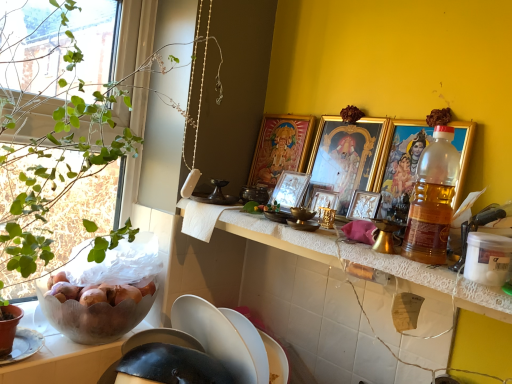
Question: Considering the positions of point (39, 23) and point (406, 178), is point (39, 23) closer or farther from the camera than point (406, 178)?

Choices:
 (A) farther
 (B) closer

Answer: (B)

Question: Would you say green leafy plant at left is to the left or to the right of gold-framed picture at right, arranged as the 5th picture frame when viewed from the back, in the picture?

Choices:
 (A) right
 (B) left

Answer: (B)

Question: Which object is the closest to the translucent plastic bottle at right?

Choices:
 (A) white lace countertop at center
 (B) green leafy plant at left
 (C) gold metallic picture frame at upper center, the fourth picture frame positioned from the back
 (D) metallic silver picture frame at center, positioned as the third picture frame in front-to-back order
 (E) gold-framed picture at center, arranged as the fourth picture frame when viewed from the front

Answer: (A)

Question: Which object is the farthest from the gold-framed picture at center, arranged as the fourth picture frame when viewed from the front?

Choices:
 (A) translucent plastic bottle at right
 (B) gold-framed picture at right, which is the 1th picture frame in front-to-back order
 (C) metallic silver picture frame at center, positioned as the third picture frame in front-to-back order
 (D) metallic silver picture frame at center, the first picture frame in the back-to-front sequence
 (E) gold metallic picture frame at upper center, the 2th picture frame positioned from the front

Answer: (A)